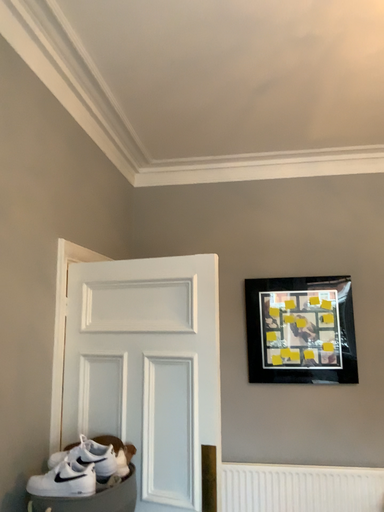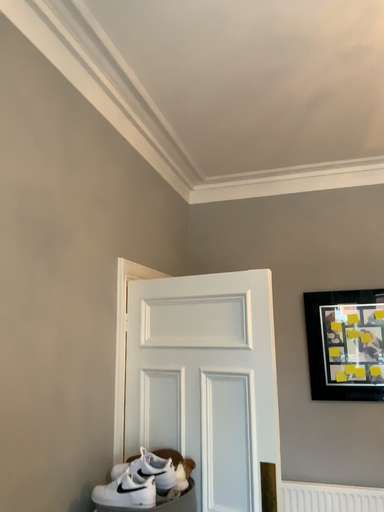
Question: Which way did the camera rotate in the video?

Choices:
 (A) rotated left
 (B) rotated right

Answer: (A)